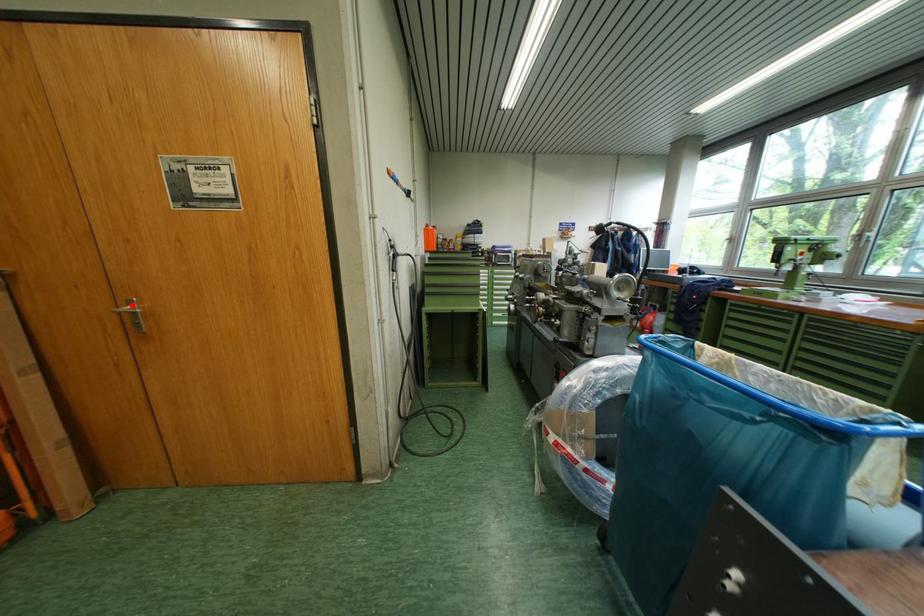
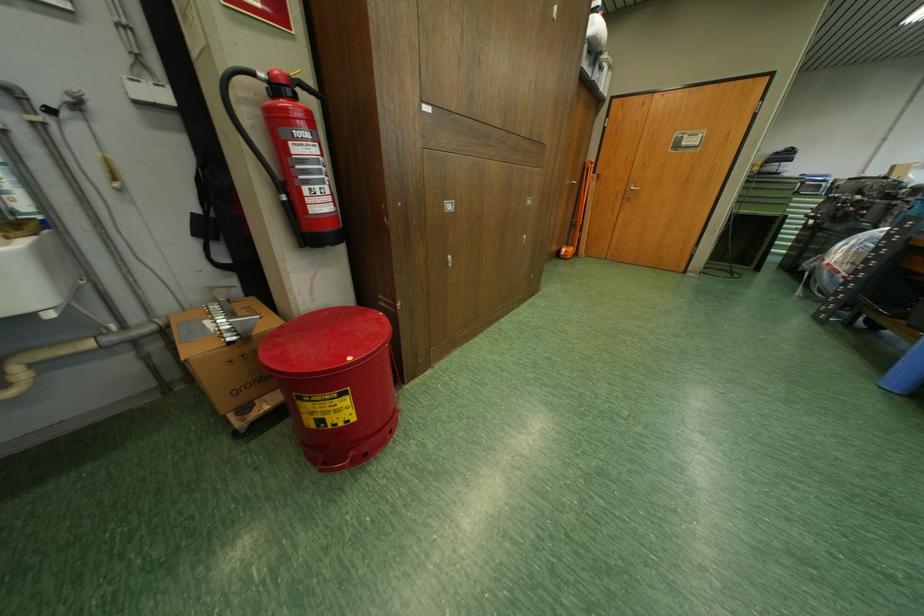
In the second image, find the point that corresponds to the highlighted location in the first image.

(638, 188)